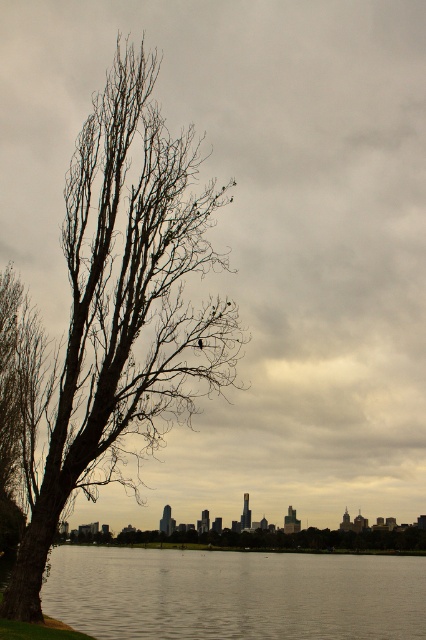
Question: Which object is farther from the camera taking this photo?

Choices:
 (A) smooth gray water at lower center
 (B) bare wood tree at left
 (C) bare branches at left

Answer: (B)

Question: Which of the following is the closest to the observer?

Choices:
 (A) smooth gray water at lower center
 (B) bare branches at left

Answer: (B)

Question: Considering the relative positions of smooth gray water at lower center and bare wood tree at left in the image provided, where is smooth gray water at lower center located with respect to bare wood tree at left?

Choices:
 (A) left
 (B) right

Answer: (A)

Question: Can you confirm if bare branches at left is positioned to the left of bare wood tree at left?

Choices:
 (A) no
 (B) yes

Answer: (B)

Question: Which object is the closest to the smooth gray water at lower center?

Choices:
 (A) bare wood tree at left
 (B) bare branches at left

Answer: (A)

Question: Observing the image, what is the correct spatial positioning of bare branches at left in reference to bare wood tree at left?

Choices:
 (A) above
 (B) below

Answer: (A)